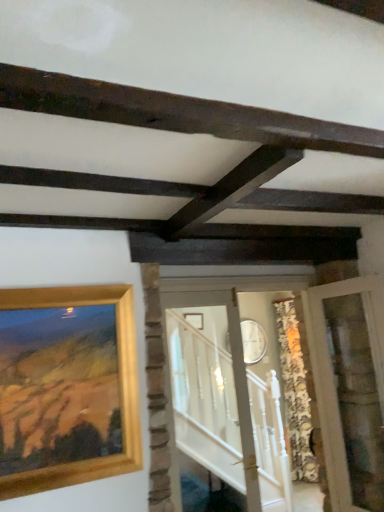
Question: Do you think clear glass door at right, the second glass door from the left, is within dark brown wood at upper center, or outside of it?

Choices:
 (A) outside
 (B) inside

Answer: (A)

Question: In the image, is clear glass door at right, which is the first glass door from right to left, positioned in front of or behind dark brown wood at upper center?

Choices:
 (A) front
 (B) behind

Answer: (B)

Question: Which object is the farthest from the clear glass door at right, the second glass door from the left?

Choices:
 (A) clear glass door at center, marked as the second glass door in a right-to-left arrangement
 (B) dark brown wood at upper center
 (C) gold wooden picture frame at upper left

Answer: (B)

Question: Considering the real-world distances, which object is closest to the dark brown wood at upper center?

Choices:
 (A) clear glass door at right, which is the first glass door from right to left
 (B) gold wooden picture frame at upper left
 (C) clear glass door at center, marked as the second glass door in a right-to-left arrangement

Answer: (B)